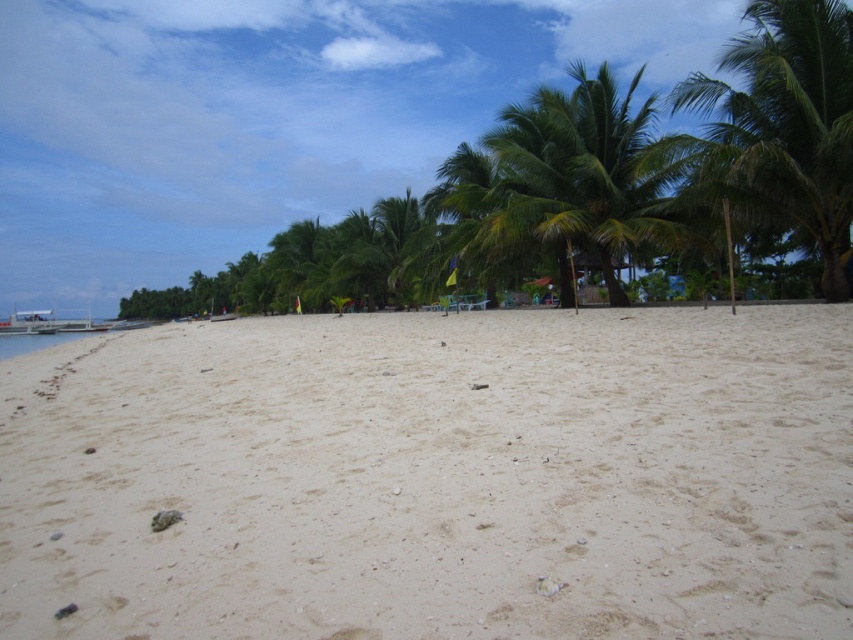
Is white sandy beach at center above green leafy palm tree at center?

No, white sandy beach at center is not above green leafy palm tree at center.

Is white sandy beach at center shorter than green leafy palm tree at center?

Yes.

Is point (819, 324) positioned in front of point (299, 289)?

Yes, point (819, 324) is in front of point (299, 289).

Find the location of a particular element. white sandy beach at center is located at coordinates (434, 477).

Who is positioned more to the right, green leafy palm tree at upper right or green leafy palm tree at center?

green leafy palm tree at upper right

Is point (521, 125) less distant than point (305, 252)?

Yes.

Does point (526, 193) come behind point (285, 288)?

No, it is in front of (285, 288).

I want to click on green leafy palm tree at upper right, so click(581, 172).

Does white sandy beach at center appear over green leafy palm tree at upper right?

No.

Image resolution: width=853 pixels, height=640 pixels. What do you see at coordinates (434, 477) in the screenshot?
I see `white sandy beach at center` at bounding box center [434, 477].

Locate an element on the screen. white sandy beach at center is located at coordinates (434, 477).